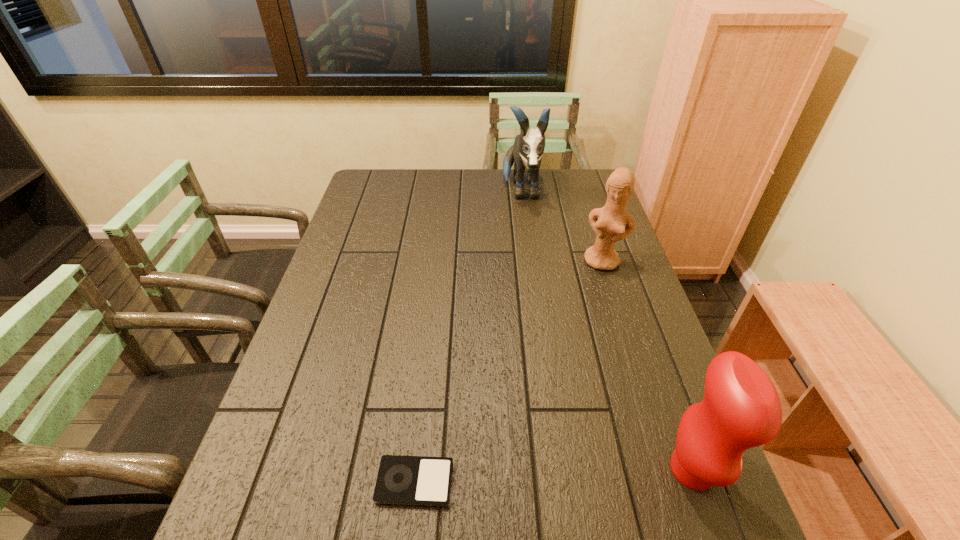
Where is `free spot on the desktop that is between the iPod and the condiment and is positioned on the front-facing side of the second farthest object`? Image resolution: width=960 pixels, height=540 pixels. free spot on the desktop that is between the iPod and the condiment and is positioned on the front-facing side of the second farthest object is located at coordinates (538, 476).

Where is `free space on the desktop that is between the iPod and the condiment and is positioned on the front-facing side of the farthest object`? free space on the desktop that is between the iPod and the condiment and is positioned on the front-facing side of the farthest object is located at coordinates (560, 475).